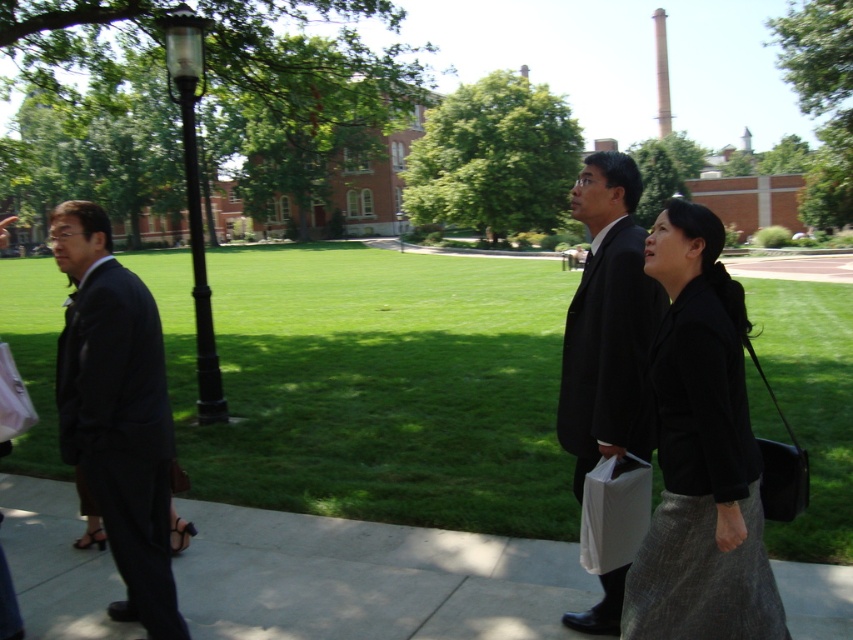
Does point (113, 477) lie in front of point (627, 320)?

Yes, point (113, 477) is in front of point (627, 320).

Can you confirm if matte black suit at left is positioned to the right of black matte suit at center?

In fact, matte black suit at left is to the left of black matte suit at center.

Who is more distant from viewer, (74, 339) or (592, 316)?

Point (592, 316)

Identify the location of matte black suit at left. The height and width of the screenshot is (640, 853). (117, 412).

Between green grass at center and black matte suit at center, which one is positioned higher?

green grass at center

Between green grass at center and black matte suit at center, which one appears on the left side from the viewer's perspective?

Positioned to the left is green grass at center.

This screenshot has height=640, width=853. Find the location of `green grass at center`. green grass at center is located at coordinates (375, 385).

Is green grass at center wider than black textured blazer at center?

Yes.

Is point (747, 296) positioned behind point (663, 541)?

Yes, it is behind point (663, 541).

Between point (437, 413) and point (686, 456), which one is positioned behind?

The point (437, 413) is behind.

Where is `green grass at center`? green grass at center is located at coordinates (375, 385).